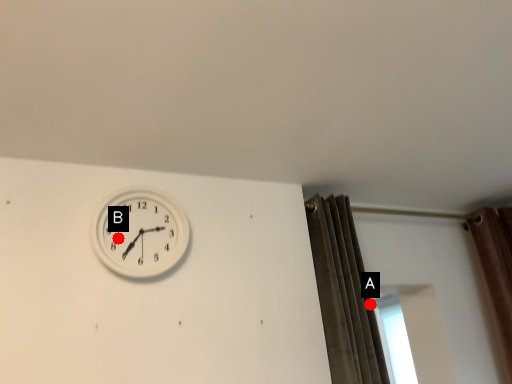
Question: Two points are circled on the image, labeled by A and B beside each circle. Which point is farther from the camera taking this photo?

Choices:
 (A) A is further
 (B) B is further

Answer: (A)